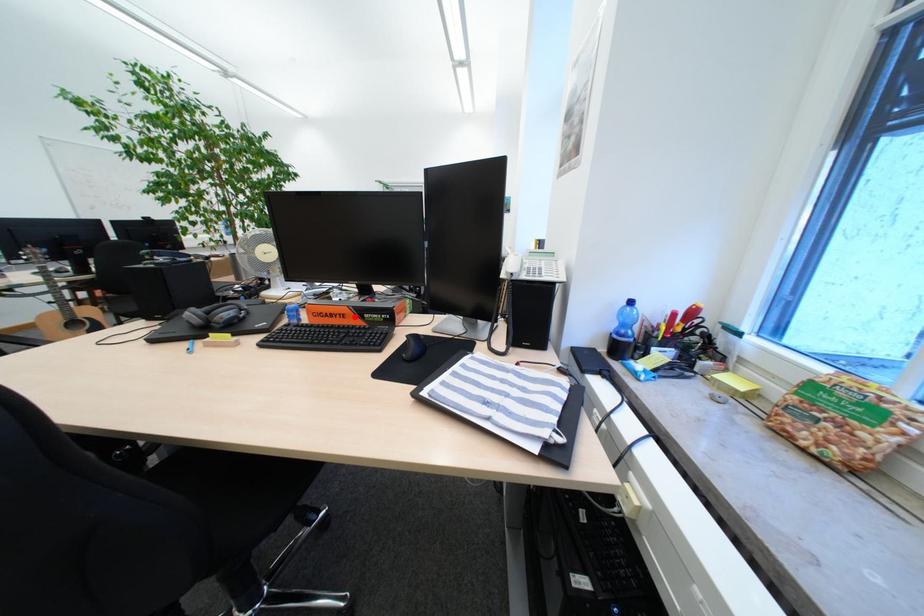
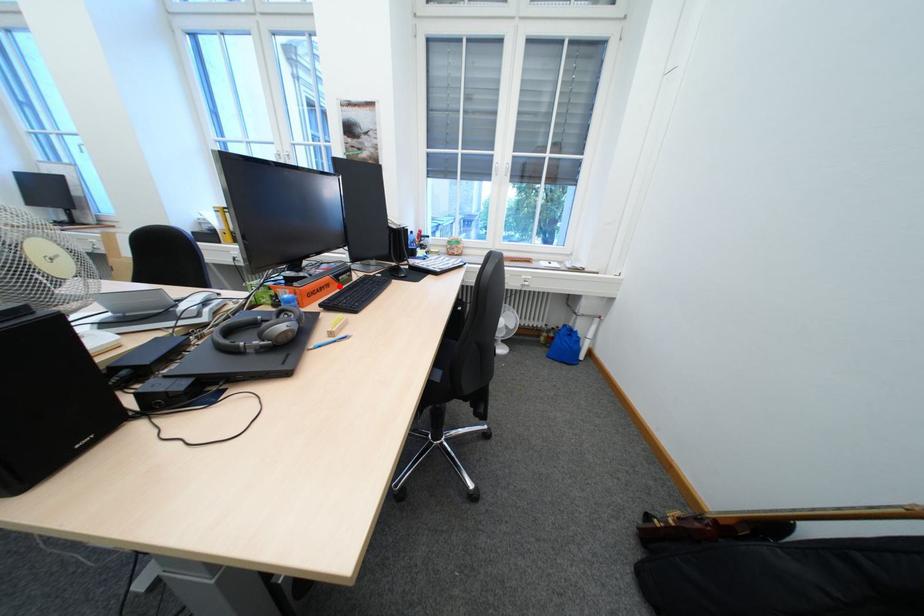
I am providing you with two images of the same scene from different viewpoints. A red point is marked on the first image and another point is marked on the second image. Do the highlighted points in image1 and image2 indicate the same real-world spot?

Yes